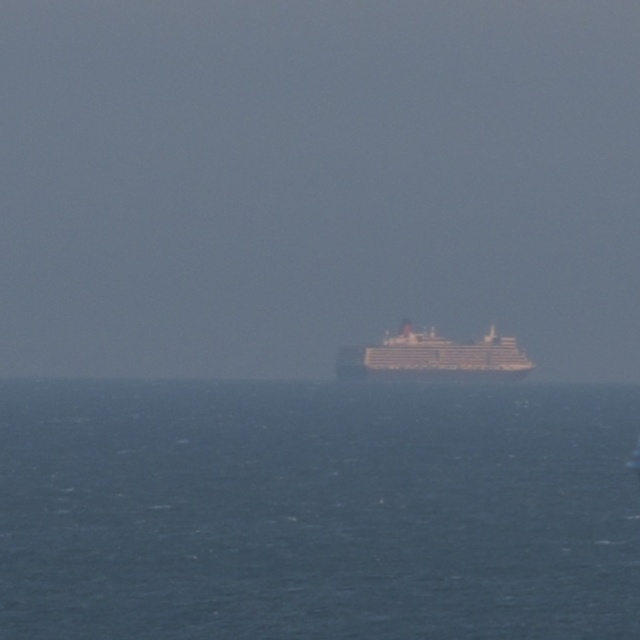
You are a photographer on a balcony of the white glossy ship at center. You want to capture the entire ship in your photo. Considering the blue water at center, will the ship fit horizontally in your frame?

The blue water at center is wider than the white glossy ship at center. Since the ship is narrower than the water area, the ship will fit horizontally within the frame.

You are an observer on the deck of the white glossy ship at center. Looking around, you notice the blue water at center. Which one appears taller from your viewpoint?

The white glossy ship at center appears taller than the blue water at center because the blue water at center has a lesser height compared to the white glossy ship at center.